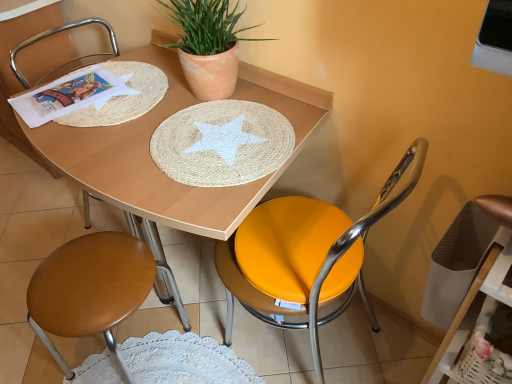
At what (x,y) coordinates should I click in order to perform the action: click on space that is in front of metallic silver armchair at left. Please return your answer as a coordinate pair (x, y). The image size is (512, 384). Looking at the image, I should click on (40, 209).